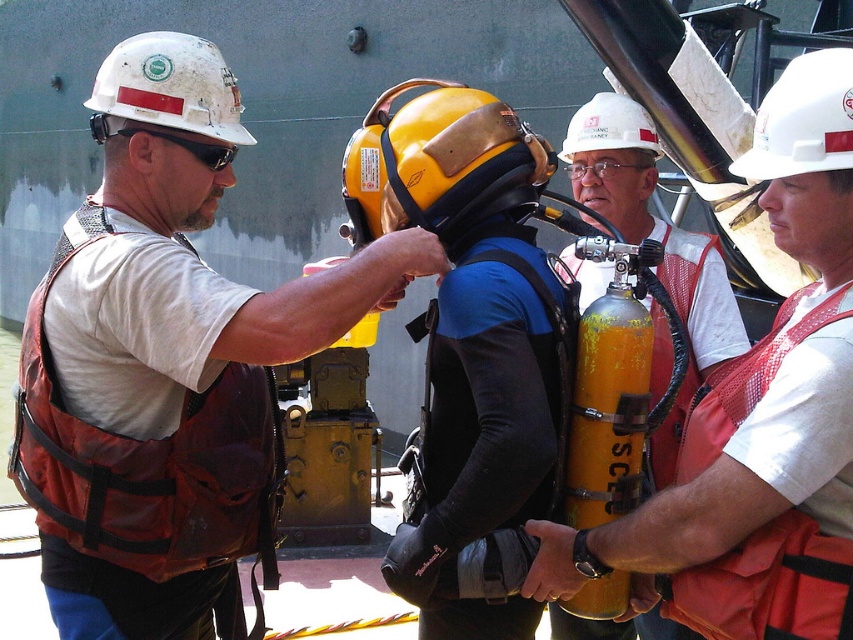
Question: Does matte orange cylinder at center have a larger size compared to yellow matte gas cylinder at center?

Choices:
 (A) yes
 (B) no

Answer: (A)

Question: Does matte yellow diving helmet at center have a lesser width compared to white hard hat at center?

Choices:
 (A) yes
 (B) no

Answer: (B)

Question: Can you confirm if orange mesh life vest at left is bigger than white matte helmet at upper right?

Choices:
 (A) no
 (B) yes

Answer: (B)

Question: Which of the following is the farthest from the observer?

Choices:
 (A) (828, 99)
 (B) (821, 566)
 (C) (567, 161)

Answer: (C)

Question: Which of these objects is positioned farthest from the yellow matte helmet at center?

Choices:
 (A) orange mesh safety vest at right
 (B) matte brown vest at left
 (C) yellow matte gas cylinder at center

Answer: (A)

Question: Estimate the real-world distances between objects in this image. Which object is closer to the matte orange cylinder at center?

Choices:
 (A) yellow matte gas cylinder at center
 (B) white hard hat at center

Answer: (B)